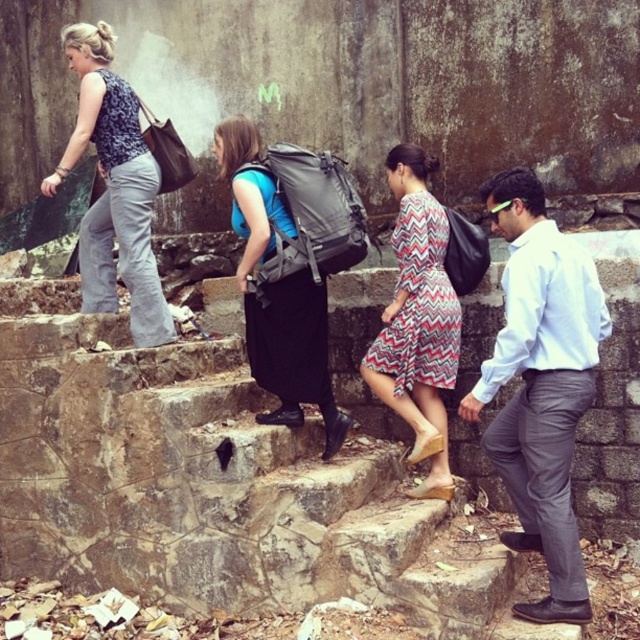
Question: Considering the relative positions of light blue shirt at center and matte black top at left in the image provided, where is light blue shirt at center located with respect to matte black top at left?

Choices:
 (A) left
 (B) right

Answer: (B)

Question: Which object is the closest to the stone stairs at center?

Choices:
 (A) chevron-patterned fabric dress at center
 (B) light blue shirt at center

Answer: (A)

Question: Is the position of stone stairs at center more distant than that of matte gray backpack at center?

Choices:
 (A) yes
 (B) no

Answer: (B)

Question: Can you confirm if matte gray backpack at center is smaller than black cotton dress at center?

Choices:
 (A) yes
 (B) no

Answer: (B)

Question: Which point is closer to the camera?

Choices:
 (A) (561, 488)
 (B) (150, 188)
 (C) (330, 451)

Answer: (A)

Question: Which point appears closest to the camera in this image?

Choices:
 (A) (282, 380)
 (B) (300, 392)
 (C) (136, 122)

Answer: (A)